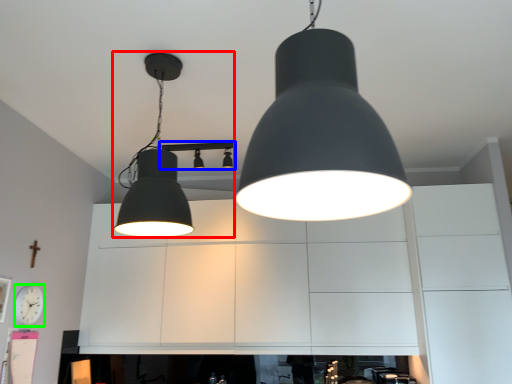
Question: Which object is positioned farthest from lamp (highlighted by a red box)? Select from lamp (highlighted by a blue box) and clock (highlighted by a green box).

Choices:
 (A) lamp
 (B) clock

Answer: (A)